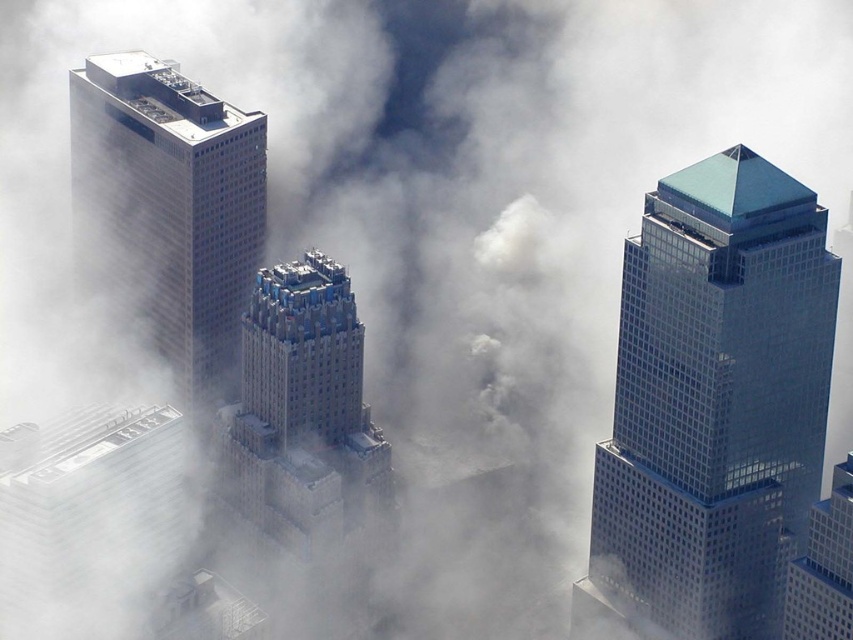
Question: Can you confirm if matte glass skyscraper at left is positioned below gray concrete skyscraper at center?

Choices:
 (A) no
 (B) yes

Answer: (A)

Question: Considering the real-world distances, which object is closest to the glassy blue skyscraper at center?

Choices:
 (A) white fluffy cloud at center
 (B) matte glass skyscraper at left
 (C) gray concrete skyscraper at center

Answer: (A)

Question: Among these objects, which one is nearest to the camera?

Choices:
 (A) glassy blue skyscraper at center
 (B) gray concrete skyscraper at center
 (C) white fluffy cloud at center

Answer: (B)

Question: Is glassy blue skyscraper at center to the right of white fluffy cloud at center from the viewer's perspective?

Choices:
 (A) no
 (B) yes

Answer: (B)

Question: Estimate the real-world distances between objects in this image. Which object is closer to the gray concrete skyscraper at center?

Choices:
 (A) matte glass skyscraper at left
 (B) glassy blue skyscraper at center

Answer: (A)

Question: Considering the relative positions of glassy blue skyscraper at center and matte glass skyscraper at left in the image provided, where is glassy blue skyscraper at center located with respect to matte glass skyscraper at left?

Choices:
 (A) left
 (B) right

Answer: (B)